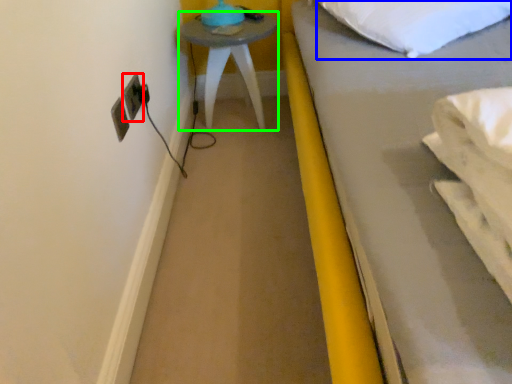
Question: Based on their relative distances, which object is nearer to electric outlet (highlighted by a red box)? Choose from pillow (highlighted by a blue box) and furniture (highlighted by a green box).

Choices:
 (A) pillow
 (B) furniture

Answer: (B)